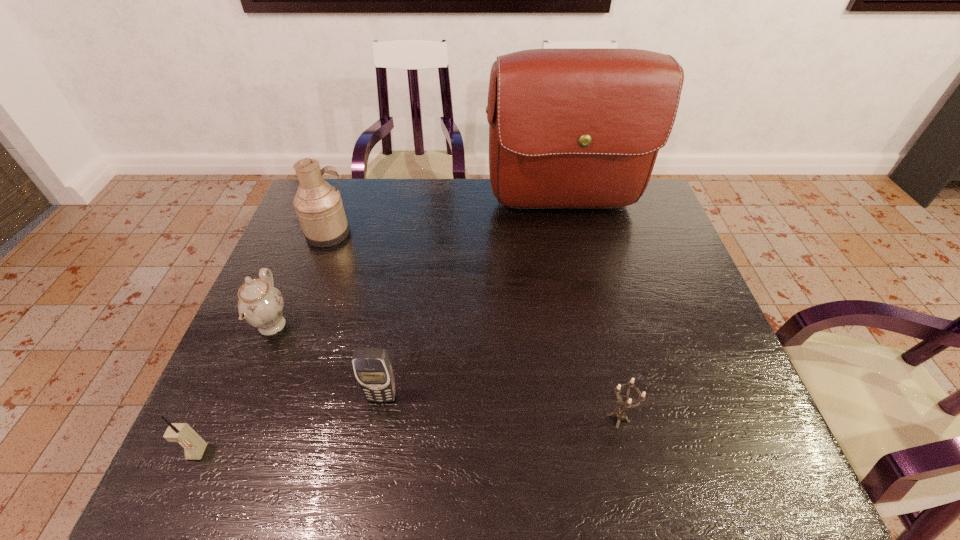
You are a GUI agent. You are given a task and a screenshot of the screen. Output one action in this format:
    pyautogui.click(x=<x>, y=<y>)
    Task: Click on the object at the right edge
    
    Given the screenshot: What is the action you would take?
    pyautogui.click(x=568, y=127)

Identify the location of object at the far left corner. This screenshot has width=960, height=540. (318, 205).

Locate an element on the screen. object that is at the near left corner is located at coordinates (194, 446).

The width and height of the screenshot is (960, 540). I want to click on object that is at the far right corner, so click(568, 127).

Where is `vacant area at the far edge of the desktop`? This screenshot has height=540, width=960. vacant area at the far edge of the desktop is located at coordinates (436, 183).

The image size is (960, 540). I want to click on vacant space at the near edge, so click(x=495, y=471).

Locate an element on the screen. Image resolution: width=960 pixels, height=540 pixels. vacant space at the left edge is located at coordinates [x=269, y=414].

This screenshot has height=540, width=960. I want to click on vacant region at the right edge of the desktop, so click(658, 325).

Where is `vacant position at the far right corner of the desktop`? vacant position at the far right corner of the desktop is located at coordinates (641, 224).

Where is `empty space that is in between the right cellular telephone and the candle holder`? empty space that is in between the right cellular telephone and the candle holder is located at coordinates (500, 408).